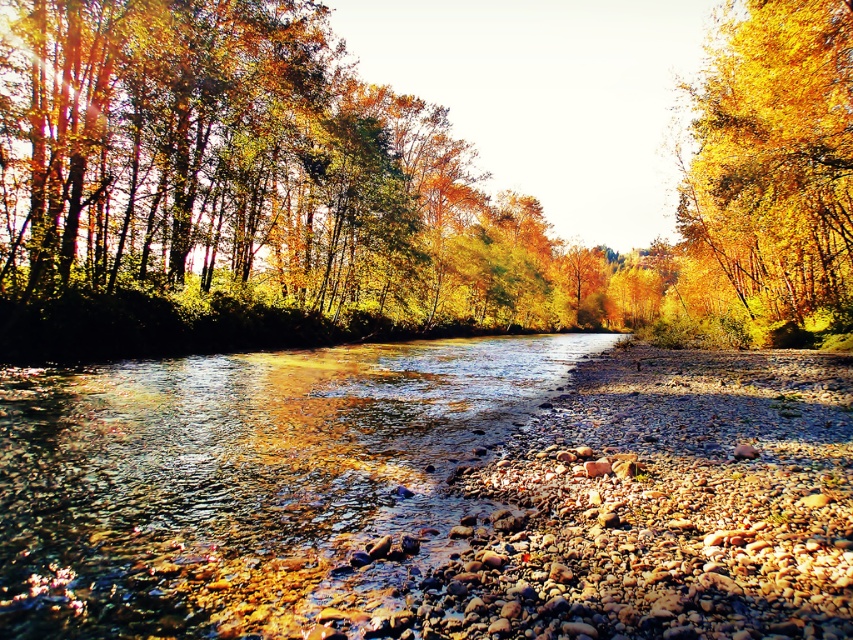
Question: Can you confirm if clear water at center is thinner than golden leafy tree at upper right?

Choices:
 (A) no
 (B) yes

Answer: (B)

Question: Which of the following is the closest to the observer?

Choices:
 (A) golden textured tree at center
 (B) golden leafy tree at upper right

Answer: (B)

Question: Is golden textured tree at center thinner than golden leafy tree at upper right?

Choices:
 (A) yes
 (B) no

Answer: (B)

Question: Which object appears closest to the camera in this image?

Choices:
 (A) golden leafy tree at upper right
 (B) golden textured tree at center
 (C) clear water at center

Answer: (C)

Question: Is golden textured tree at center closer to the viewer compared to golden leafy tree at upper right?

Choices:
 (A) yes
 (B) no

Answer: (B)

Question: Which is farther from the golden leafy tree at upper right?

Choices:
 (A) golden textured tree at center
 (B) clear water at center

Answer: (B)